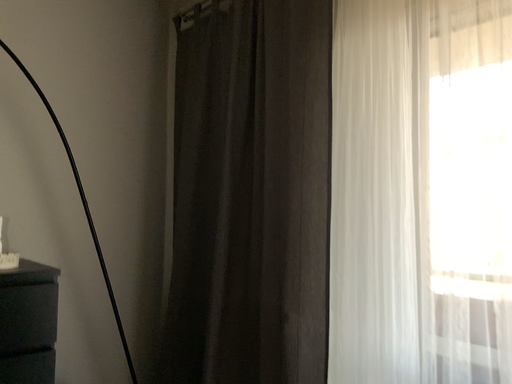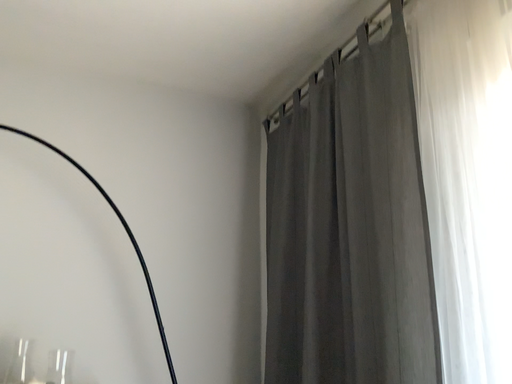
Question: How did the camera likely rotate when shooting the video?

Choices:
 (A) rotated upward
 (B) rotated downward

Answer: (A)